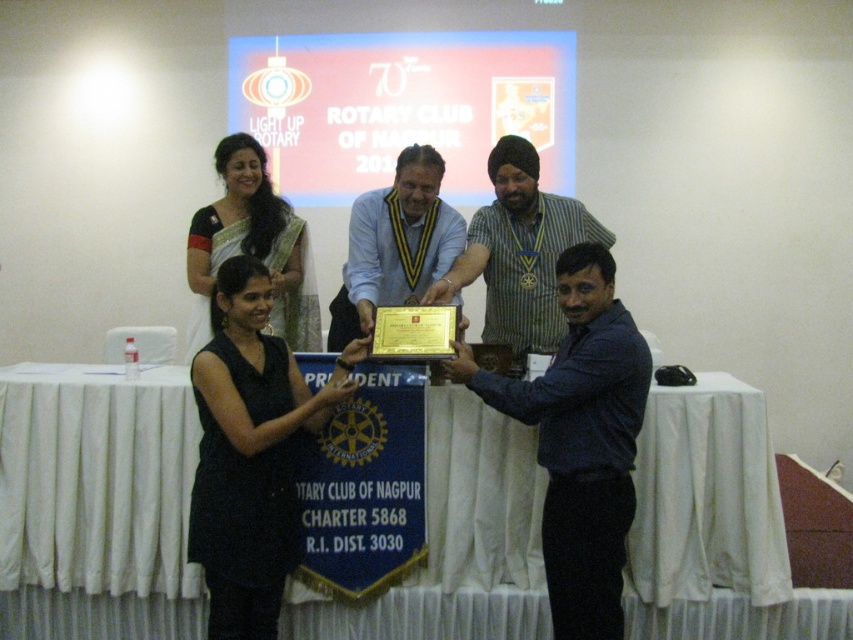
You are attending the Rotary Club of Nagpur 70th anniversary event and notice two attendees wearing a blue denim shirt at center and a black dress at center. From your perspective, which clothing item is positioned higher on the person?

The blue denim shirt at center is above the black dress at center, so the blue denim shirt at center is positioned higher on the person.

You are a photographer at the event and need to capture a photo of the black dress at center and the green silk saree at upper left. The camera has a maximum focus range of 30 inches. Can you capture both items in focus without moving the camera?

The black dress at center is 28.93 inches from the green silk saree at upper left. Since the distance between them is within the camera maximum focus range of 30 inches, you can capture both items in focus without moving the camera.

You are attending the event and want to take a photo of the black dress at center and the green silk saree at upper left. Which one is on the left side when facing the table?

The green silk saree at upper left is on the left side when facing the table because the black dress at center is positioned on the right side of it.